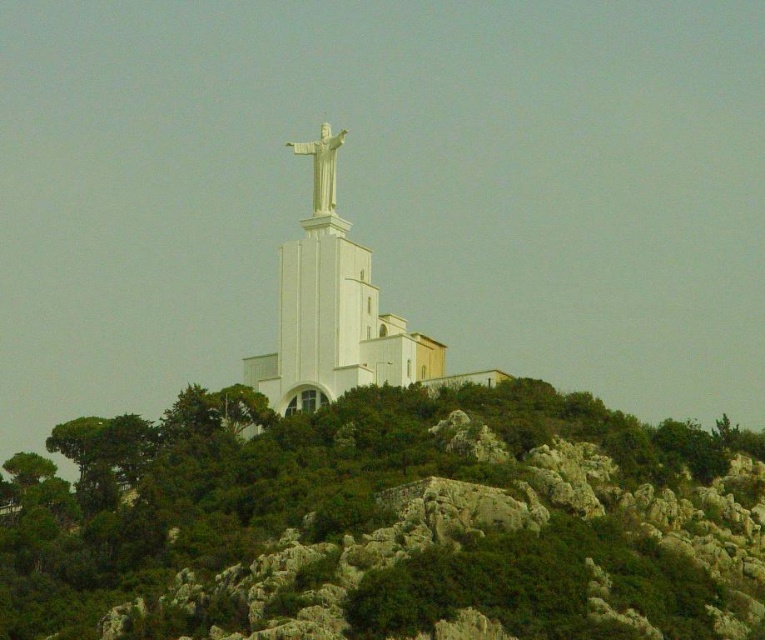
Between point (18, 595) and point (327, 150), which one is positioned in front?

Point (18, 595) is more forward.

Is point (147, 540) positioned behind point (344, 131)?

No, it is in front of (344, 131).

Locate an element on the screen. This screenshot has height=640, width=765. green leafy hillside at center is located at coordinates (389, 524).

Is green leafy hillside at center above white smooth statue at center?

Actually, green leafy hillside at center is below white smooth statue at center.

Who is lower down, green leafy hillside at center or white smooth statue at center?

Positioned lower is green leafy hillside at center.

This screenshot has height=640, width=765. I want to click on green leafy hillside at center, so click(389, 524).

Where is `green leafy hillside at center`? This screenshot has width=765, height=640. green leafy hillside at center is located at coordinates (389, 524).

Does white smooth statue at center have a lesser width compared to white marble statue at center?

No.

Is white smooth statue at center to the left of white marble statue at center from the viewer's perspective?

No, white smooth statue at center is not to the left of white marble statue at center.

Measure the distance between point (x=383, y=340) and camera.

The distance of point (x=383, y=340) from camera is 118.53 meters.

Where is `white smooth statue at center`? This screenshot has width=765, height=640. white smooth statue at center is located at coordinates (334, 310).